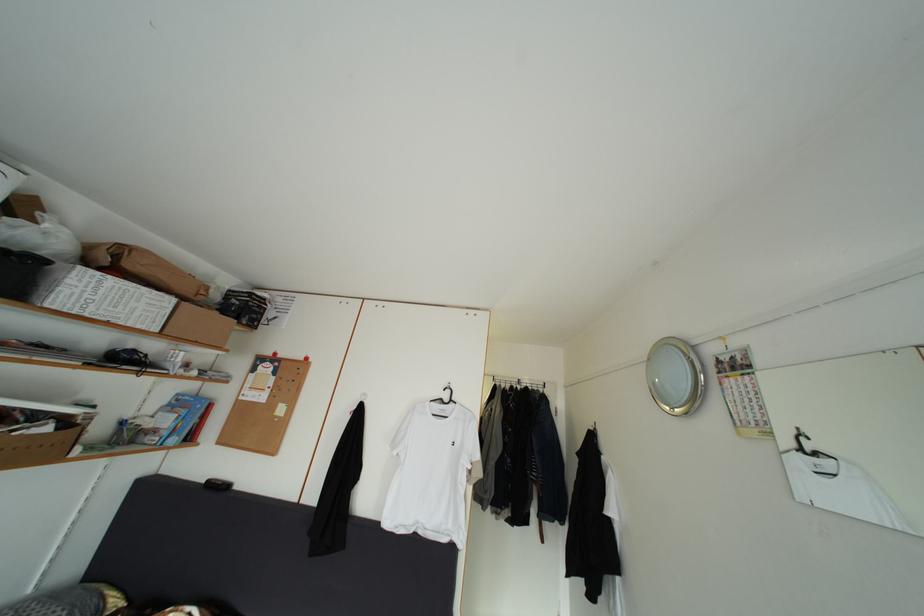
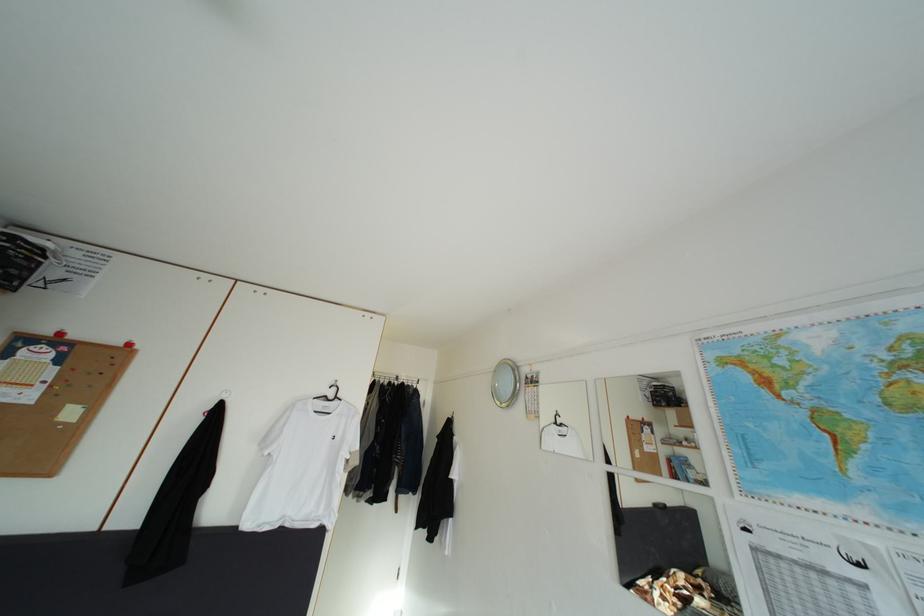
Locate, in the second image, the point that corresponds to (x=455, y=403) in the first image.

(339, 400)